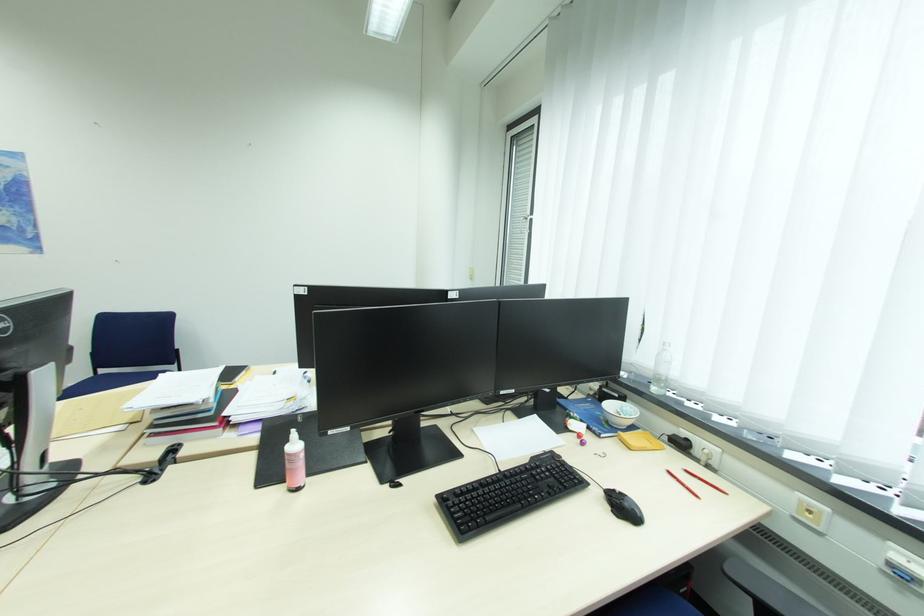
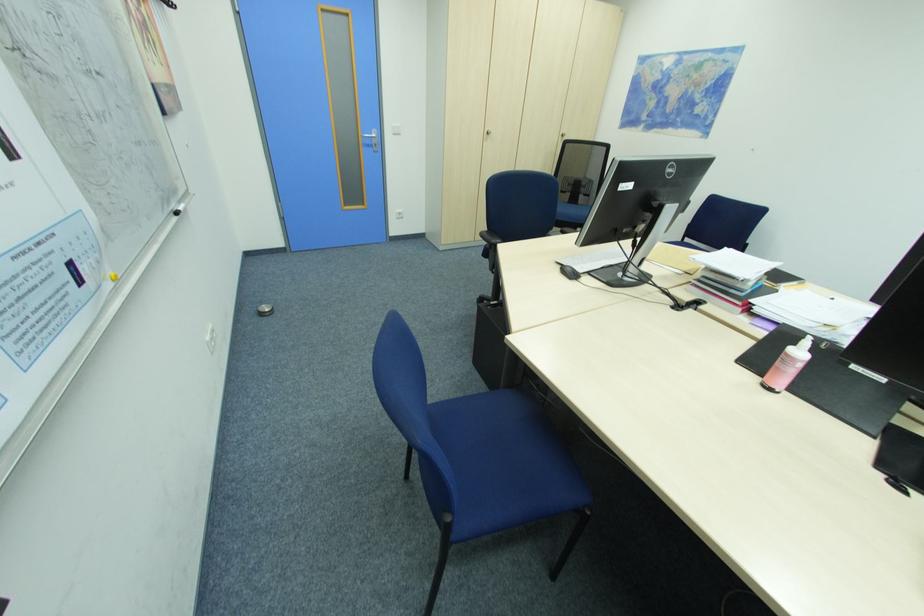
First-person continuous shooting, in which direction is the camera rotating?

The camera rotated toward left-down.